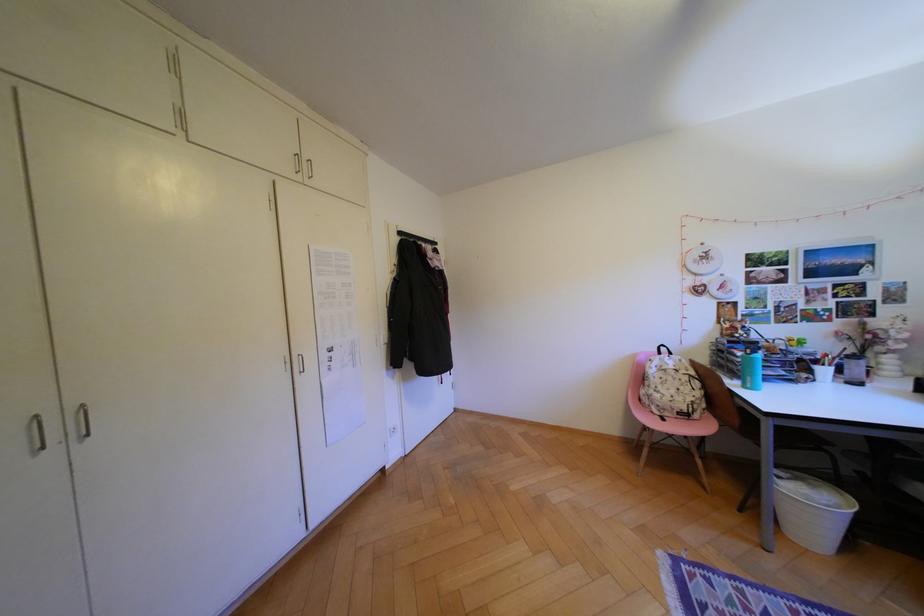
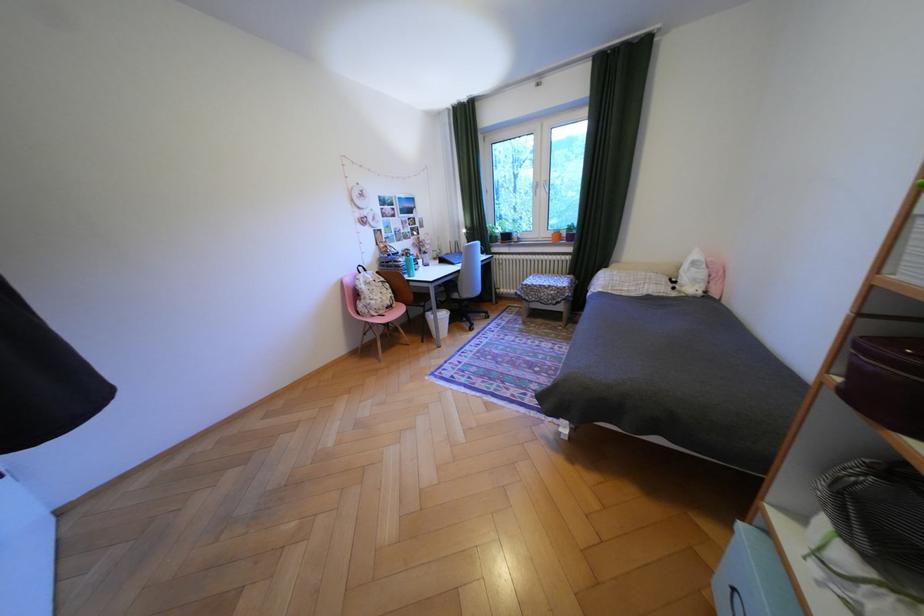
The point at (682,379) is marked in the first image. Where is the corresponding point in the second image?

(386, 288)